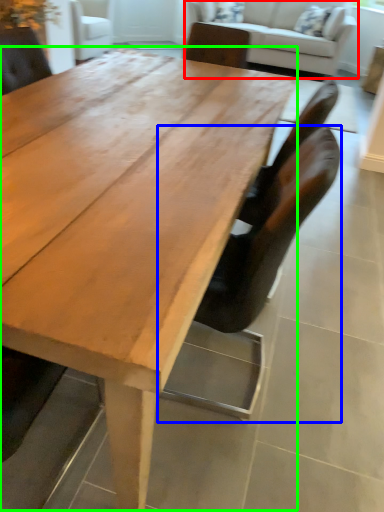
Question: Which object is the closest to the studio couch (highlighted by a red box)? Choose among these: chair (highlighted by a blue box) or coffee table (highlighted by a green box).

Choices:
 (A) chair
 (B) coffee table

Answer: (B)